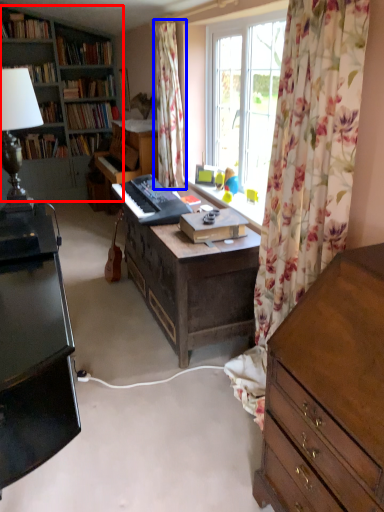
Question: Which object is further to the camera taking this photo, bookcase (highlighted by a red box) or curtain (highlighted by a blue box)?

Choices:
 (A) bookcase
 (B) curtain

Answer: (A)